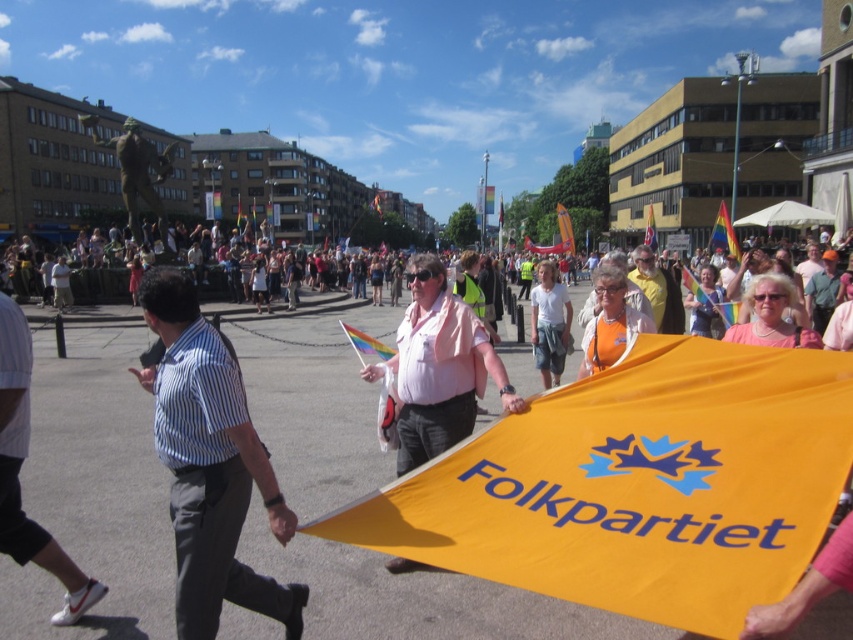
Question: Which point is closer to the camera taking this photo?

Choices:
 (A) (717, 243)
 (B) (16, 547)
 (C) (543, 364)
 (D) (281, 502)

Answer: (D)

Question: Is blue striped shirt at center wider than orange fabric at center?

Choices:
 (A) no
 (B) yes

Answer: (B)

Question: Considering the real-world distances, which object is farthest from the white fabric pants at lower left?

Choices:
 (A) orange fabric at center
 (B) white cotton t-shirt at center
 (C) pink fabric shirt at center

Answer: (B)

Question: Which of the following is the closest to the observer?

Choices:
 (A) blue striped shirt at center
 (B) pink fabric shirt at center

Answer: (A)

Question: Is pink fabric shirt at center further to camera compared to white cotton t-shirt at center?

Choices:
 (A) yes
 (B) no

Answer: (B)

Question: Considering the relative positions of pink fabric shirt at center and rainbow fabric flag at upper center in the image provided, where is pink fabric shirt at center located with respect to rainbow fabric flag at upper center?

Choices:
 (A) left
 (B) right

Answer: (A)